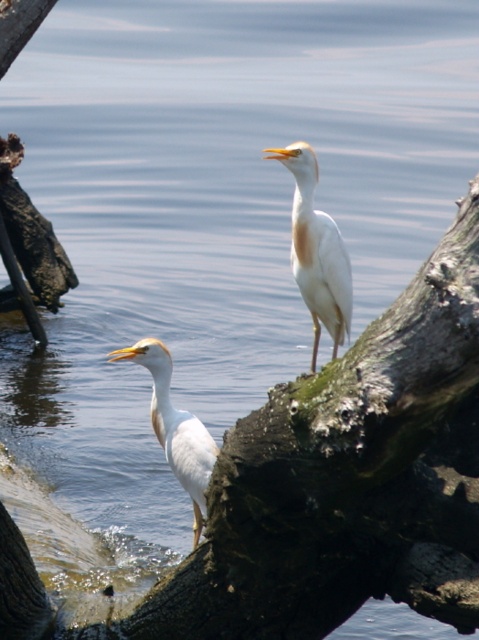
You are a photographer trying to capture a closeup shot of the white matte bird at center and the white smooth heron at lower left. Given that your camera lens can focus on subjects within a 3 feet range, will you be able to get both birds in focus at the same time?

The distance between the white matte bird at center and the white smooth heron at lower left is 3.67 feet, which exceeds the camera lens range of 3 feet. Therefore, you cannot get both birds in focus simultaneously.

You are a birdwatcher observing the scene. You notice the white matte bird at center and the white smooth heron at lower left. Which bird is closer to you?

The white matte bird at center is closer to you because the white smooth heron at lower left is behind it.